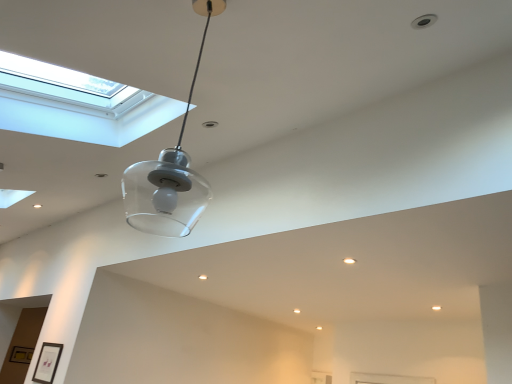
Question: Can you confirm if matte black picture frame at lower left, acting as the first picture frame starting from the front, is smaller than transparent glass window at upper left?

Choices:
 (A) no
 (B) yes

Answer: (B)

Question: Does matte black picture frame at lower left, which is the second picture frame in back-to-front order, have a lesser height compared to transparent glass window at upper left?

Choices:
 (A) no
 (B) yes

Answer: (B)

Question: From a real-world perspective, is matte black picture frame at lower left, which is the second picture frame in back-to-front order, positioned over transparent glass window at upper left based on gravity?

Choices:
 (A) yes
 (B) no

Answer: (B)

Question: Is matte black picture frame at lower left, the first picture frame from the right, positioned far away from transparent glass window at upper left?

Choices:
 (A) no
 (B) yes

Answer: (B)

Question: Is matte black picture frame at lower left, the 2th picture frame from the left, positioned behind transparent glass window at upper left?

Choices:
 (A) yes
 (B) no

Answer: (A)

Question: From the image's perspective, is matte black picture frame at lower left, positioned as the first picture frame in top-to-bottom order, on transparent glass window at upper left?

Choices:
 (A) yes
 (B) no

Answer: (B)

Question: Can transparent glass window at upper left be found inside gold metallic picture frame at lower left, acting as the 2th picture frame starting from the top?

Choices:
 (A) no
 (B) yes

Answer: (A)

Question: Is gold metallic picture frame at lower left, which is counted as the first picture frame, starting from the left, looking in the opposite direction of transparent glass window at upper left?

Choices:
 (A) yes
 (B) no

Answer: (B)

Question: Is gold metallic picture frame at lower left, marked as the first picture frame in a bottom-to-top arrangement, to the right of transparent glass window at upper left from the viewer's perspective?

Choices:
 (A) no
 (B) yes

Answer: (A)

Question: From a real-world perspective, is gold metallic picture frame at lower left, acting as the 2th picture frame starting from the top, physically below transparent glass window at upper left?

Choices:
 (A) no
 (B) yes

Answer: (B)

Question: Considering the relative positions of gold metallic picture frame at lower left, which is the 2th picture frame in front-to-back order, and transparent glass window at upper left in the image provided, is gold metallic picture frame at lower left, which is the 2th picture frame in front-to-back order, in front of transparent glass window at upper left?

Choices:
 (A) no
 (B) yes

Answer: (A)

Question: Does gold metallic picture frame at lower left, which ranks as the 2th picture frame in right-to-left order, appear on the left side of transparent glass window at upper left?

Choices:
 (A) no
 (B) yes

Answer: (B)

Question: Considering the relative sizes of matte black picture frame at lower left, acting as the first picture frame starting from the front, and gold metallic picture frame at lower left, marked as the first picture frame in a bottom-to-top arrangement, in the image provided, is matte black picture frame at lower left, acting as the first picture frame starting from the front, smaller than gold metallic picture frame at lower left, marked as the first picture frame in a bottom-to-top arrangement,?

Choices:
 (A) no
 (B) yes

Answer: (A)